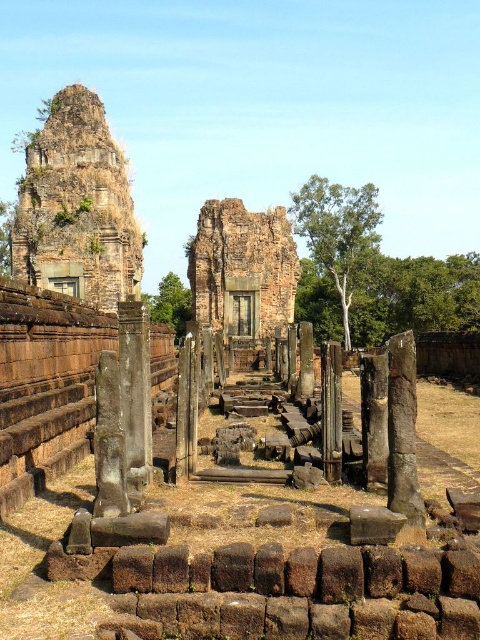
Question: From the image, what is the correct spatial relationship of rusty stone tower at upper left in relation to brown stone ruins at center?

Choices:
 (A) below
 (B) above

Answer: (B)

Question: Can you confirm if rusty stone tower at upper left is smaller than brown stone ruins at center?

Choices:
 (A) no
 (B) yes

Answer: (B)

Question: Which point appears farthest from the camera in this image?

Choices:
 (A) (416, 508)
 (B) (54, 193)
 (C) (137, 305)

Answer: (B)

Question: Which point is closer to the camera?

Choices:
 (A) brown stone pillar at center
 (B) brown stone ruins at center
 (C) smooth stone pillar at center
 (D) rusty stone tower at upper left

Answer: (C)

Question: Does rusty stone tower at upper left have a greater width compared to brown stone pillar at center?

Choices:
 (A) no
 (B) yes

Answer: (B)

Question: Estimate the real-world distances between objects in this image. Which object is closer to the smooth stone pillar at center?

Choices:
 (A) brown stone ruins at center
 (B) rusty stone tower at upper left

Answer: (B)